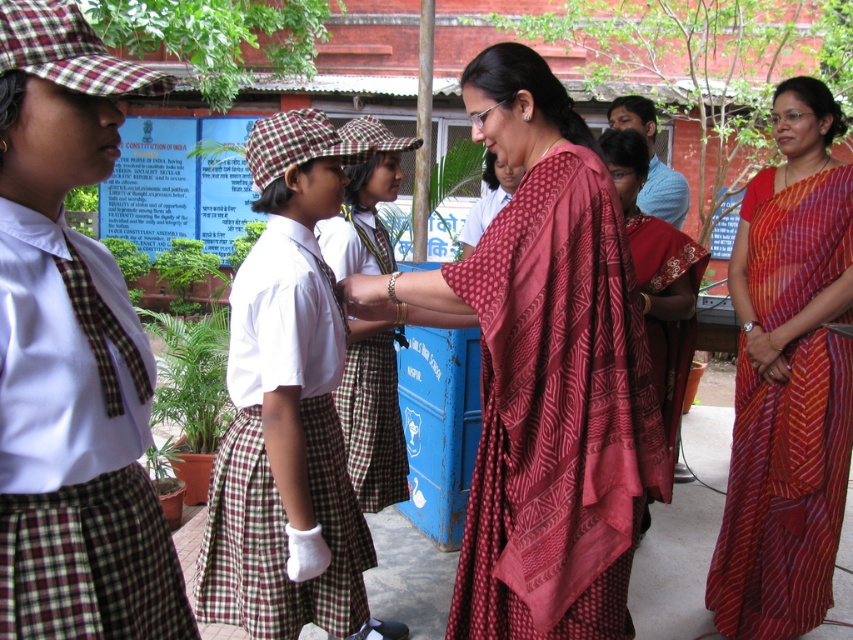
Question: Which is farther from the maroon woven sari at center?

Choices:
 (A) checkered fabric dress at center
 (B) matte plaid uniform at center

Answer: (B)

Question: Considering the real-world distances, which object is farthest from the checkered fabric dress at center?

Choices:
 (A) maroon printed sari at center
 (B) matte plaid uniform at center
 (C) maroon woven sari at center
 (D) red striped sari at center

Answer: (D)

Question: Estimate the real-world distances between objects in this image. Which object is closer to the red striped sari at center?

Choices:
 (A) matte plaid uniform at center
 (B) checkered fabric dress at center
 (C) maroon printed sari at center

Answer: (C)

Question: Is red striped sari at center positioned before checkered fabric dress at center?

Choices:
 (A) no
 (B) yes

Answer: (A)

Question: Considering the relative positions of maroon printed sari at center and checkered fabric dress at center in the image provided, where is maroon printed sari at center located with respect to checkered fabric dress at center?

Choices:
 (A) right
 (B) left

Answer: (A)

Question: Does matte plaid uniform at center have a lesser width compared to checkered fabric dress at center?

Choices:
 (A) no
 (B) yes

Answer: (B)